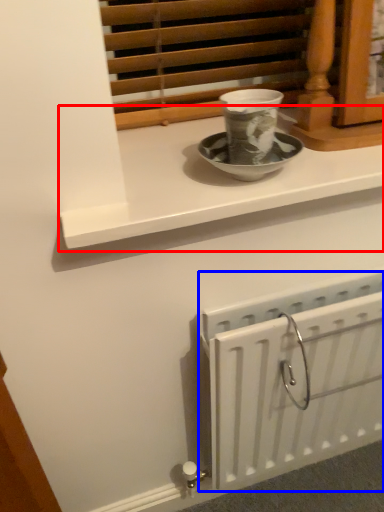
Question: Which point is further to the camera, window sill (highlighted by a red box) or radiator (highlighted by a blue box)?

Choices:
 (A) window sill
 (B) radiator

Answer: (B)